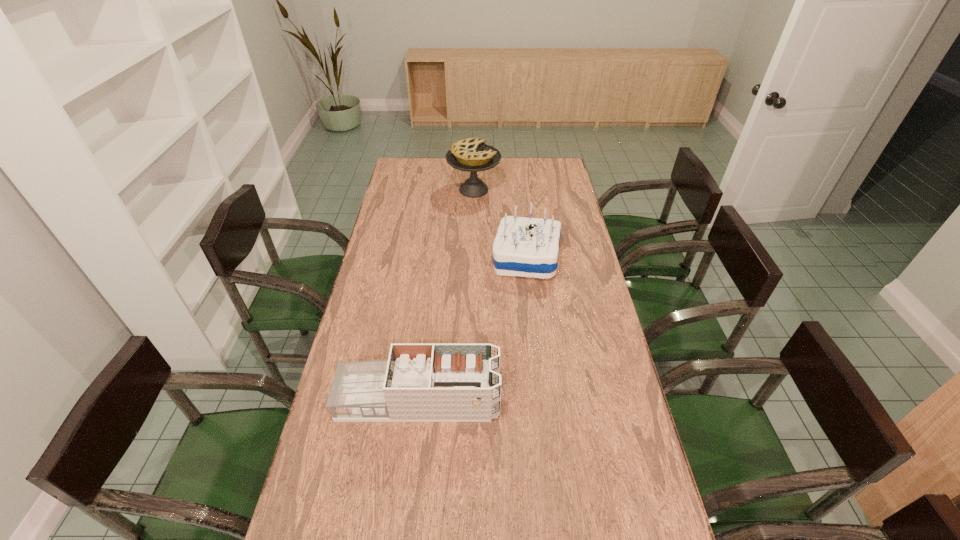
The width and height of the screenshot is (960, 540). Identify the location of the farthest object. (472, 155).

Where is `the second nearest object`? the second nearest object is located at coordinates (527, 247).

I want to click on the nearest object, so click(x=419, y=382).

At what (x,y) coordinates should I click in order to perform the action: click on the shortest object. Please return your answer as a coordinate pair (x, y). The height and width of the screenshot is (540, 960). Looking at the image, I should click on tap(419, 382).

Find the location of a particular element. vacant region located 0.280m on the cut side of the farthest object is located at coordinates (560, 190).

Find the location of a particular element. vacant space located on the left of the birthday cake is located at coordinates (440, 258).

What are the coordinates of `free space located 0.110m at the entrance of the nearest object` in the screenshot? It's located at (538, 400).

At what (x,y) coordinates should I click in order to perform the action: click on object positioned at the far edge. Please return your answer as a coordinate pair (x, y). Looking at the image, I should click on (472, 155).

The image size is (960, 540). What are the coordinates of `object present at the left edge` in the screenshot? It's located at (419, 382).

Find the location of a particular element. Image resolution: width=960 pixels, height=540 pixels. object positioned at the right edge is located at coordinates (527, 247).